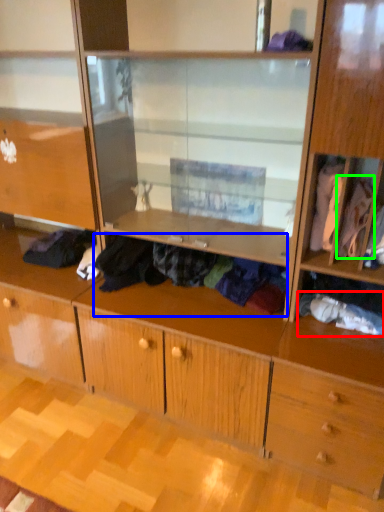
Question: Estimate the real-world distances between objects in this image. Which object is closer to clothing (highlighted by a red box), clothing (highlighted by a blue box) or clothing (highlighted by a green box)?

Choices:
 (A) clothing
 (B) clothing

Answer: (B)